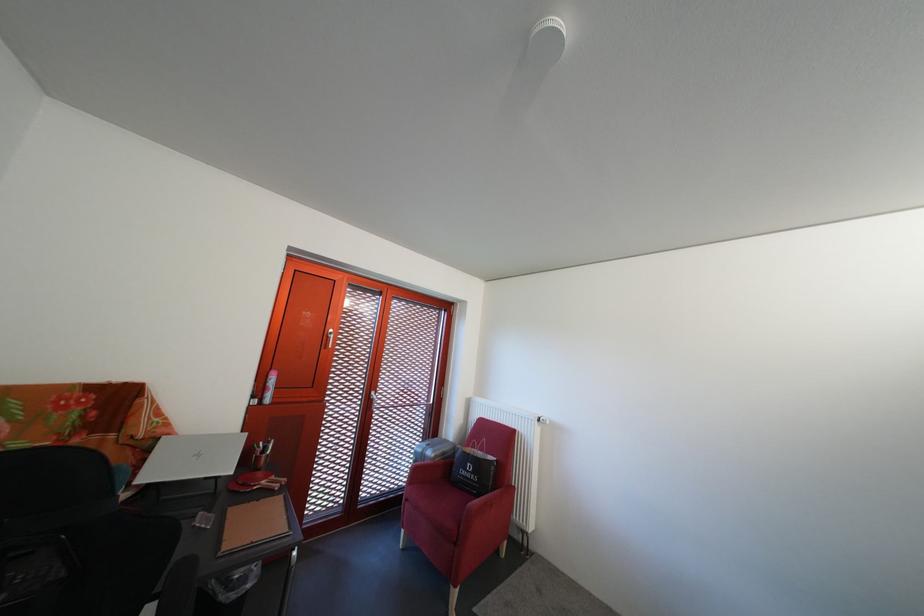
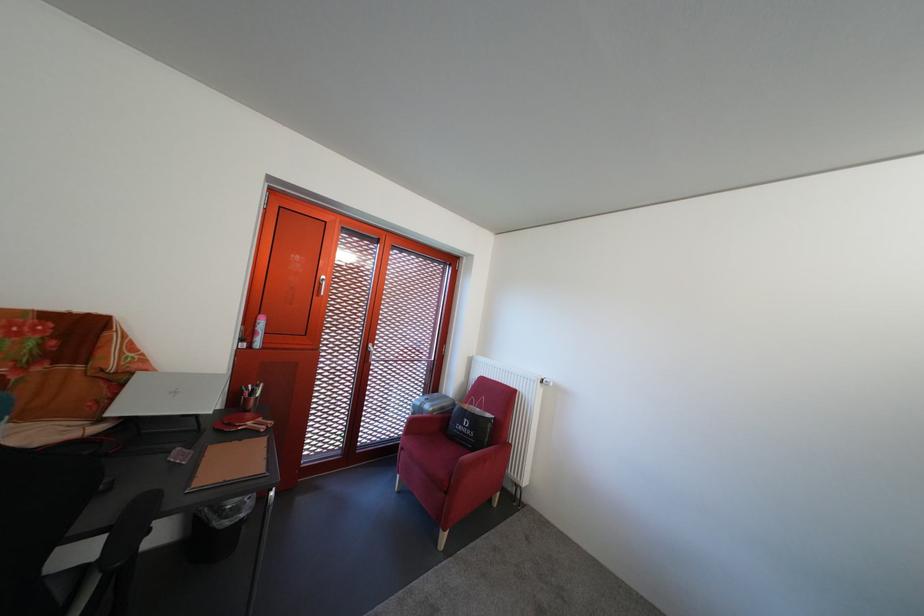
In the second image, find the point that corresponds to point (455, 460) in the first image.

(454, 415)